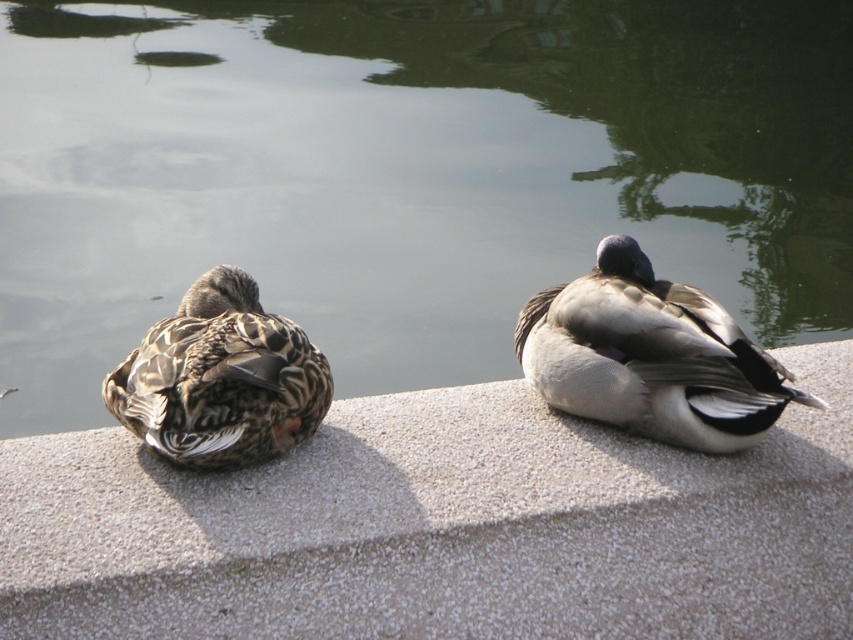
Consider the image. You are standing at the edge of the concrete surface where the two ducks are resting. You want to throw a small pebble into the green smooth water at center. Based on the coordinates provided, in which direction should you aim relative to the ducks?

The green smooth water at center is located at point coordinates, so you should aim towards the center area where the water is located, which is to the left of the ducks since the ducks are on the concrete surface on the left side of the image.

You are a birdwatcher observing two ducks on a concrete surface. You see the gray textured concrete at center and the camouflage feathered duck at left. Which object is positioned lower in the image?

The gray textured concrete at center is located below the camouflage feathered duck at left, so it is positioned lower in the image.

You are a photographer trying to capture both the green smooth water at center and the camouflage feathered duck at left in a single frame. Based on their sizes, which object should you focus on first to ensure both fit in the shot?

The green smooth water at center is smaller than the camouflage feathered duck at left, so you should focus on the camouflage feathered duck at left first to ensure both fit in the shot.